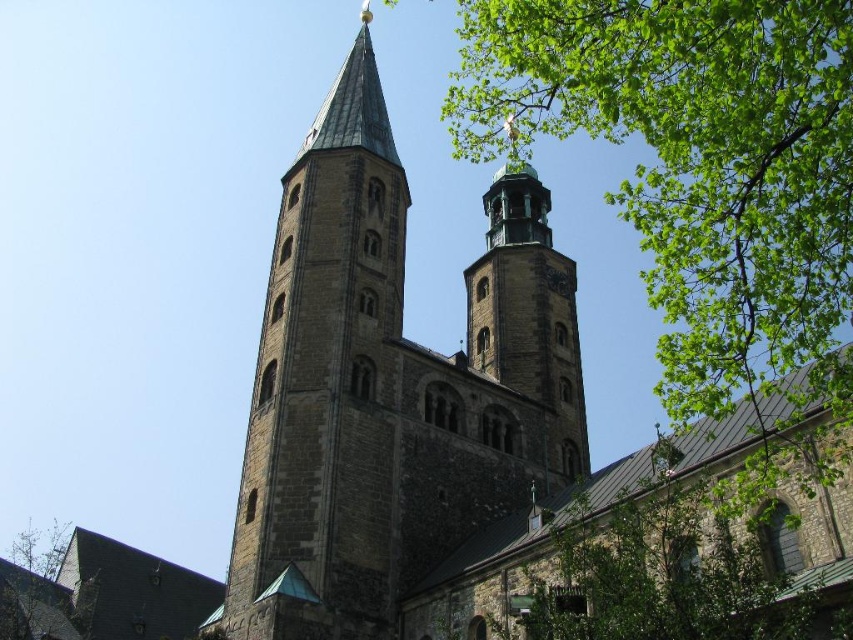
Question: Is green leafy tree at upper right below green leafy tree at lower right?

Choices:
 (A) yes
 (B) no

Answer: (B)

Question: Among these objects, which one is farthest from the camera?

Choices:
 (A) stone bell tower at center
 (B) green leafy tree at lower right
 (C) green leafy tree at upper right
 (D) dark gray stone tower at center

Answer: (A)

Question: Is dark gray stone tower at center in front of stone bell tower at center?

Choices:
 (A) yes
 (B) no

Answer: (A)

Question: Can you confirm if dark gray stone tower at center is wider than green leafy tree at lower right?

Choices:
 (A) yes
 (B) no

Answer: (B)

Question: Estimate the real-world distances between objects in this image. Which object is closer to the dark gray stone tower at center?

Choices:
 (A) green leafy tree at lower right
 (B) green leafy tree at upper right
 (C) stone bell tower at center

Answer: (C)

Question: Considering the real-world distances, which object is farthest from the green leafy tree at upper right?

Choices:
 (A) dark gray stone tower at center
 (B) stone bell tower at center
 (C) green leafy tree at lower right

Answer: (A)